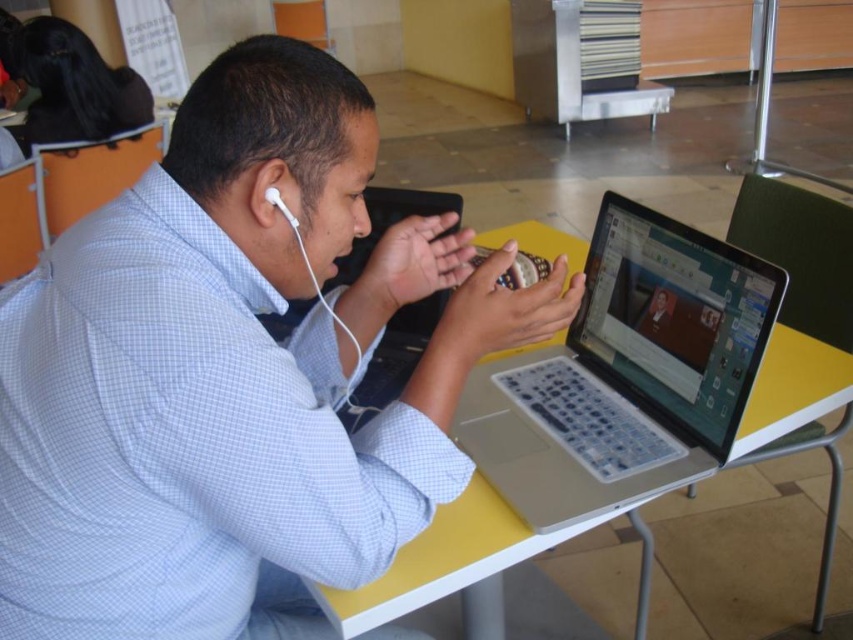
Question: Can you confirm if silver plastic laptop at center is bigger than white earphone at left?

Choices:
 (A) yes
 (B) no

Answer: (A)

Question: Is white checkered shirt at center positioned at the back of silver plastic laptop at center?

Choices:
 (A) yes
 (B) no

Answer: (B)

Question: Which point is closer to the camera taking this photo?

Choices:
 (A) pyautogui.click(x=271, y=188)
 (B) pyautogui.click(x=270, y=196)

Answer: (A)

Question: Does silver plastic laptop at center appear on the left side of white earphone at left?

Choices:
 (A) yes
 (B) no

Answer: (B)

Question: Which of the following is the closest to the observer?

Choices:
 (A) white plastic earphone at left
 (B) silver plastic laptop at center

Answer: (A)

Question: Based on their relative distances, which object is nearer to the white plastic earphone at left?

Choices:
 (A) silver plastic laptop at center
 (B) yellow plastic table at center

Answer: (A)